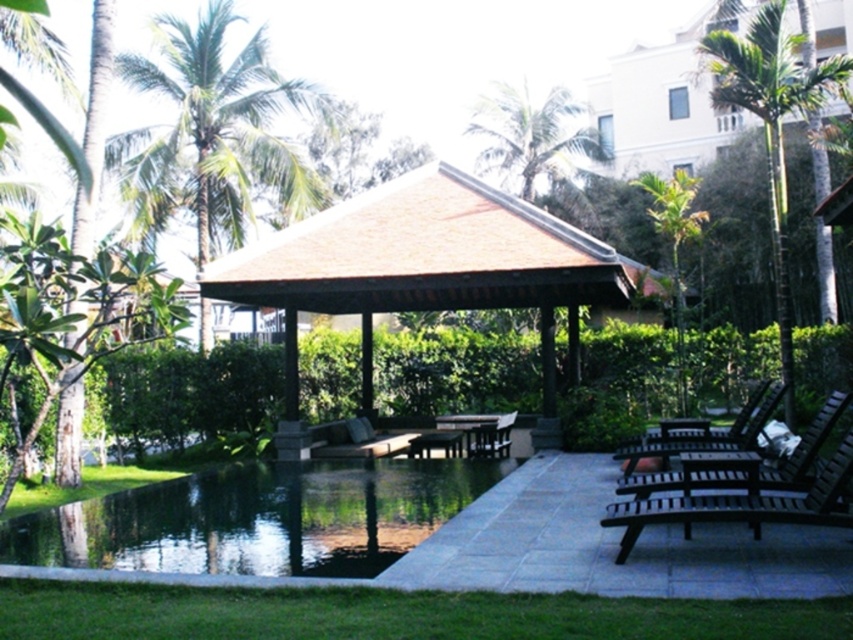
Between brown wooden gazebo at center and green leafy palm tree at upper center, which one has more height?

brown wooden gazebo at center is taller.

Where is `brown wooden gazebo at center`? This screenshot has height=640, width=853. brown wooden gazebo at center is located at coordinates (424, 273).

The width and height of the screenshot is (853, 640). What do you see at coordinates (424, 273) in the screenshot?
I see `brown wooden gazebo at center` at bounding box center [424, 273].

Find the location of a particular element. The height and width of the screenshot is (640, 853). brown wooden gazebo at center is located at coordinates (424, 273).

Can you confirm if green concrete pond at lower left is wider than green leafy palm tree at upper left?

Yes.

Which is behind, point (398, 509) or point (173, 28)?

The point (173, 28) is behind.

This screenshot has width=853, height=640. Find the location of `green concrete pond at lower left`. green concrete pond at lower left is located at coordinates (258, 518).

Does green concrete pond at lower left have a greater width compared to wooden lounge chair at center?

Yes, green concrete pond at lower left is wider than wooden lounge chair at center.

Does green concrete pond at lower left have a greater height compared to wooden lounge chair at center?

No, green concrete pond at lower left is not taller than wooden lounge chair at center.

The height and width of the screenshot is (640, 853). What do you see at coordinates (258, 518) in the screenshot?
I see `green concrete pond at lower left` at bounding box center [258, 518].

At what (x,y) coordinates should I click in order to perform the action: click on green concrete pond at lower left. Please return your answer as a coordinate pair (x, y). This screenshot has height=640, width=853. Looking at the image, I should click on (258, 518).